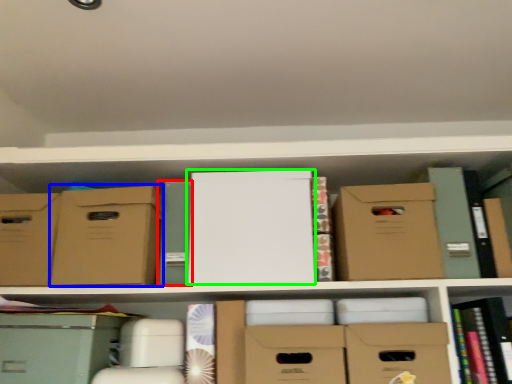
Question: Estimate the real-world distances between objects in this image. Which object is farther from paperback book (highlighted by a red box), cardboard box (highlighted by a blue box) or paperback book (highlighted by a green box)?

Choices:
 (A) cardboard box
 (B) paperback book

Answer: (B)